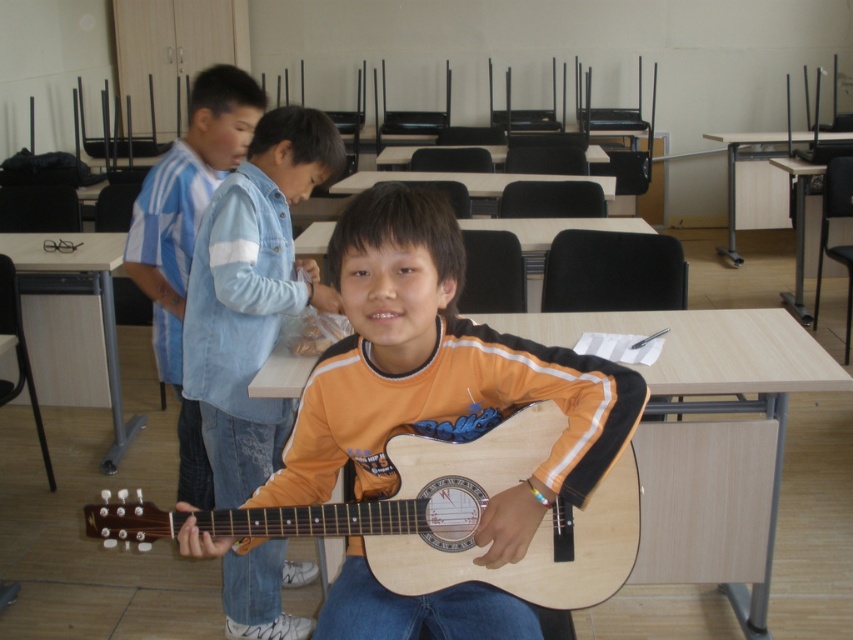
Looking at this image, does orange matte guitar at center have a greater width compared to natural wood guitar at center?

No.

Between orange matte guitar at center and natural wood guitar at center, which one is positioned lower?

natural wood guitar at center is below.

Is point (281, 179) closer to camera compared to point (498, 440)?

That is False.

Where is `orange matte guitar at center`? orange matte guitar at center is located at coordinates (252, 294).

What do you see at coordinates (439, 376) in the screenshot? I see `wooden guitar at center` at bounding box center [439, 376].

Between point (308, 458) and point (322, 285), which one is positioned in front?

Point (308, 458) is more forward.

Where is `wooden guitar at center`? This screenshot has height=640, width=853. wooden guitar at center is located at coordinates [439, 376].

Is point (283, 452) farther from viewer compared to point (514, 420)?

Yes, point (283, 452) is farther from viewer.

Can you confirm if wooden guitar at center is smaller than natural wood guitar at center?

No, wooden guitar at center is not smaller than natural wood guitar at center.

Image resolution: width=853 pixels, height=640 pixels. In order to click on wooden guitar at center in this screenshot , I will do `click(439, 376)`.

The image size is (853, 640). I want to click on wooden guitar at center, so click(439, 376).